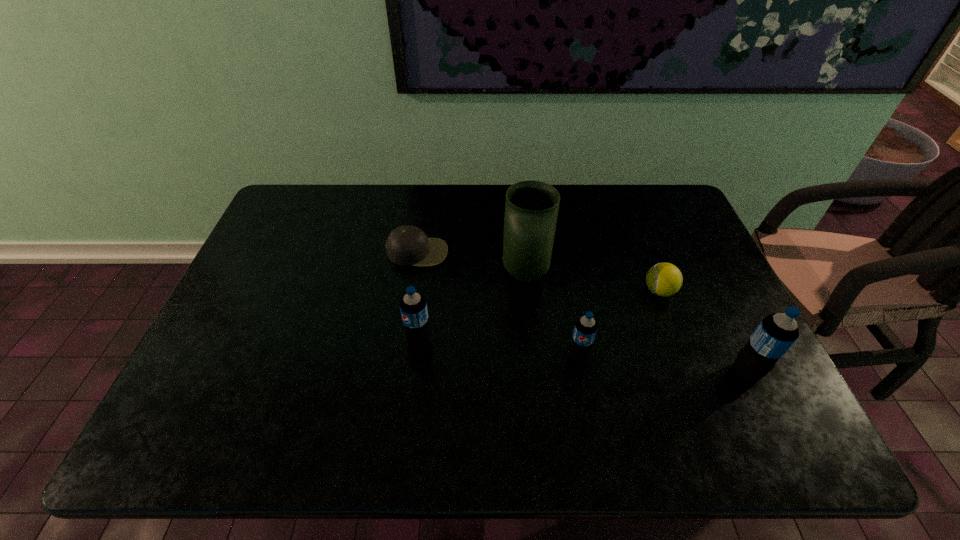
I want to click on blank area at the near edge, so click(x=321, y=403).

In the image, there is a desktop. Where is `vacant space at the left edge`? vacant space at the left edge is located at coordinates (218, 328).

You are a GUI agent. You are given a task and a screenshot of the screen. Output one action in this format:
    pyautogui.click(x=<x>, y=<y>)
    Task: Click on the free space at the right edge of the desktop
    The image size is (960, 540).
    Given the screenshot: What is the action you would take?
    pyautogui.click(x=702, y=270)

In the image, there is a desktop. At what (x,y) coordinates should I click in order to perform the action: click on vacant space at the far left corner. Please return your answer as a coordinate pair (x, y). This screenshot has height=540, width=960. Looking at the image, I should click on (300, 222).

In the image, there is a desktop. Where is `vacant space at the far right corner`? The width and height of the screenshot is (960, 540). vacant space at the far right corner is located at coordinates (643, 214).

Where is `vacant region between the rightmost soda bottle and the third object from left to right`? This screenshot has height=540, width=960. vacant region between the rightmost soda bottle and the third object from left to right is located at coordinates (636, 323).

Where is `empty location between the tennis ball and the third object from left to right`? empty location between the tennis ball and the third object from left to right is located at coordinates (592, 282).

Where is `free space that is in between the cap and the fourth object from right to left`? free space that is in between the cap and the fourth object from right to left is located at coordinates (471, 263).

You are a GUI agent. You are given a task and a screenshot of the screen. Output one action in this format:
    pyautogui.click(x=<x>, y=<y>)
    Task: Click on the vacant space in between the third shortest object and the leftmost soda bottle
    The image size is (960, 540).
    Given the screenshot: What is the action you would take?
    pyautogui.click(x=498, y=348)

At what (x,y) coordinates should I click in order to perform the action: click on free spot between the vase and the shortest soda bottle. Please return your answer as a coordinate pair (x, y). This screenshot has height=540, width=960. Looking at the image, I should click on pyautogui.click(x=552, y=315).